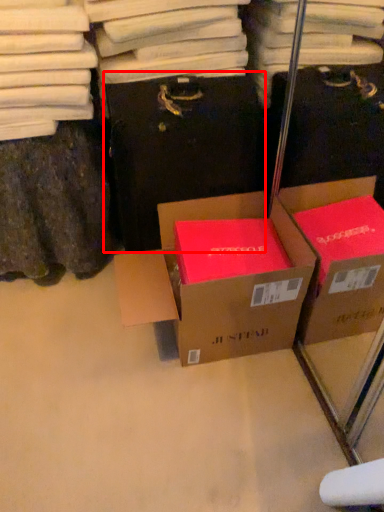
Question: From the image's perspective, what is the correct spatial relationship of cardboard box (annotated by the red box) in relation to box?

Choices:
 (A) above
 (B) below

Answer: (A)